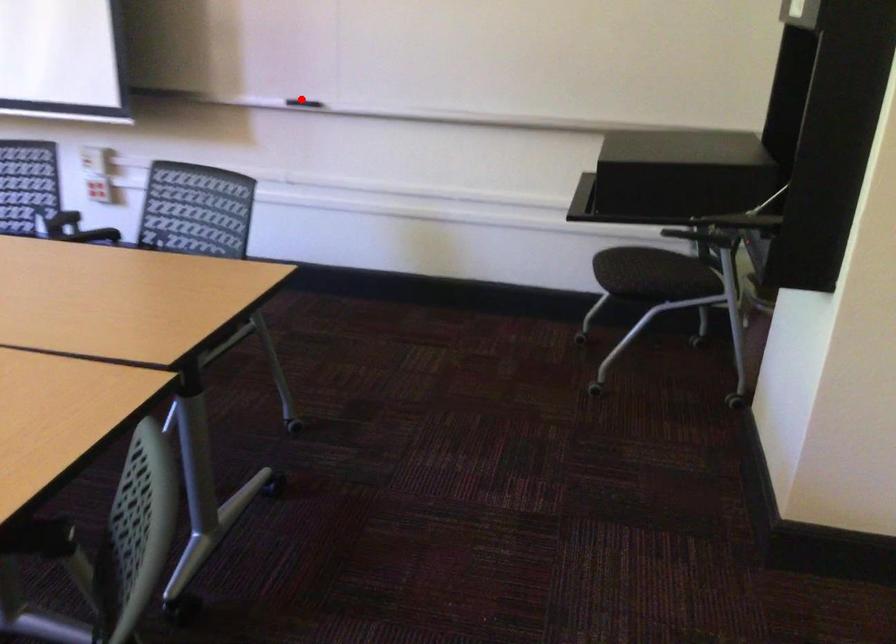
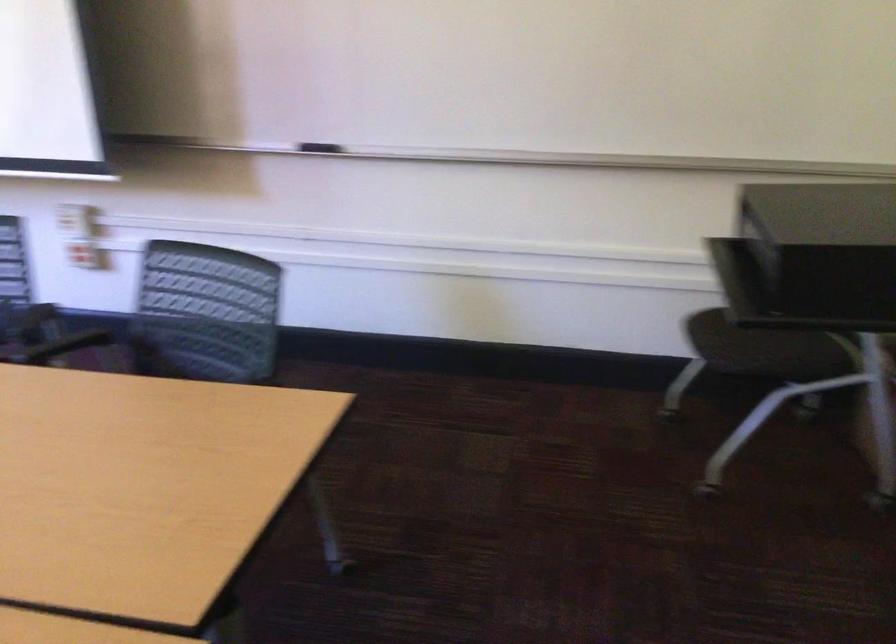
Where in the second image is the point corresponding to the highlighted location from the first image?

(319, 147)